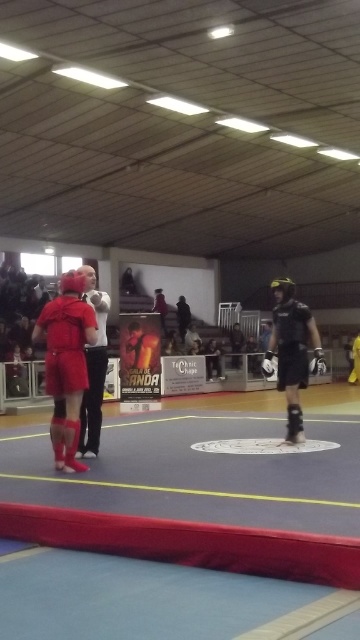
Which is behind, point (275, 330) or point (101, 394)?

Positioned behind is point (275, 330).

Is point (306, 364) in front of point (83, 404)?

No.

Identify the location of black matte uniform at center. (291, 352).

Is the position of matte red boxing gear at left less distant than that of black matte uniform at center?

Yes, it is.

Is matte red boxing gear at left thinner than black matte uniform at center?

No, matte red boxing gear at left is not thinner than black matte uniform at center.

Is point (66, 308) closer to camera compared to point (275, 292)?

Yes, it is.

Locate an element on the screen. matte red boxing gear at left is located at coordinates coord(66,364).

Which is more to the left, matte red boxing gear at left or matte black referee at center?

matte red boxing gear at left is more to the left.

What do you see at coordinates (66, 364) in the screenshot?
I see `matte red boxing gear at left` at bounding box center [66, 364].

Which is in front, point (72, 416) or point (105, 346)?

Point (72, 416)

Find the location of a particular element. This screenshot has height=640, width=360. matte red boxing gear at left is located at coordinates (66, 364).